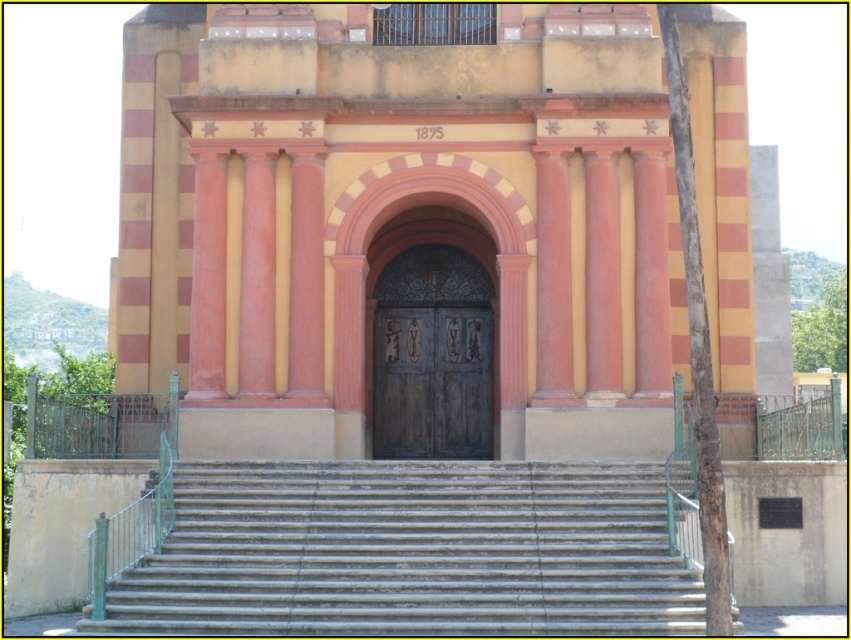
Question: Is smooth concrete stairs at lower center positioned in front of dark brown wooden door at center?

Choices:
 (A) yes
 (B) no

Answer: (A)

Question: Among these points, which one is farthest from the camera?

Choices:
 (A) (373, 628)
 (B) (455, 394)

Answer: (B)

Question: Among these objects, which one is farthest from the camera?

Choices:
 (A) smooth concrete stairs at lower center
 (B) dark brown wooden door at center

Answer: (B)

Question: Can you confirm if smooth concrete stairs at lower center is smaller than dark brown wooden door at center?

Choices:
 (A) no
 (B) yes

Answer: (A)

Question: Can you confirm if smooth concrete stairs at lower center is smaller than dark brown wooden door at center?

Choices:
 (A) yes
 (B) no

Answer: (B)

Question: Which object is closer to the camera taking this photo?

Choices:
 (A) smooth concrete stairs at lower center
 (B) dark brown wooden door at center

Answer: (A)